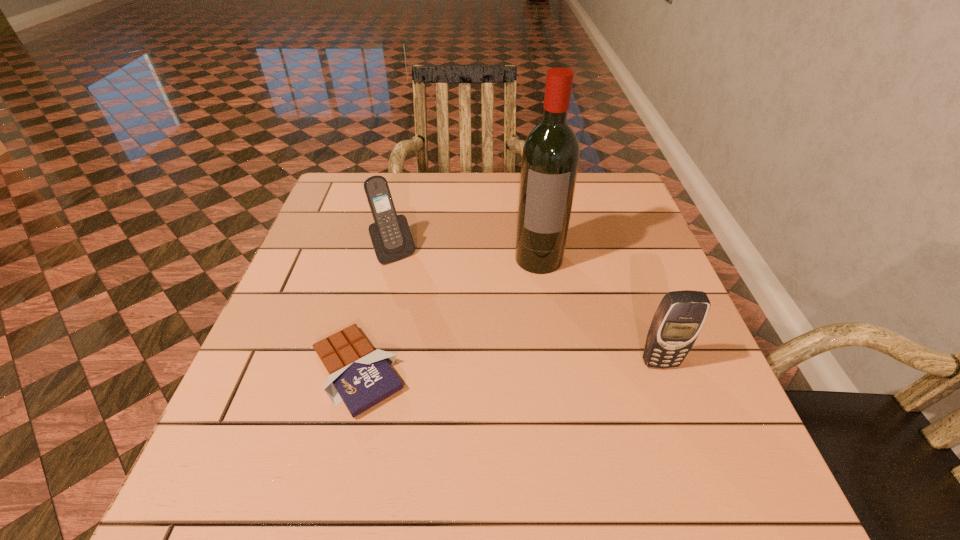
You are a GUI agent. You are given a task and a screenshot of the screen. Output one action in this format:
    pyautogui.click(x=<x>, y=<y>)
    Task: Click on the chocolate bar
    This screenshot has height=540, width=960.
    Given the screenshot: What is the action you would take?
    pyautogui.click(x=361, y=377)

At what (x,y) coordinates should I click in order to perform the action: click on the nearer cellular telephone. Please return your answer as a coordinate pair (x, y). Looking at the image, I should click on (680, 316).

Locate an element on the screen. The height and width of the screenshot is (540, 960). the right cellular telephone is located at coordinates (680, 316).

Where is `the second object from right to left`? This screenshot has width=960, height=540. the second object from right to left is located at coordinates (550, 158).

Locate an element on the screen. the tallest object is located at coordinates click(x=550, y=158).

You are a GUI agent. You are given a task and a screenshot of the screen. Output one action in this format:
    pyautogui.click(x=<x>, y=<y>)
    Task: Click on the farther cellular telephone
    The width and height of the screenshot is (960, 540).
    Given the screenshot: What is the action you would take?
    click(391, 238)

The height and width of the screenshot is (540, 960). I want to click on vacant space located on the back of the chocolate bar, so click(x=387, y=247).

Find the location of `vacant space located 0.130m on the front face of the rightmost object`. vacant space located 0.130m on the front face of the rightmost object is located at coordinates (685, 434).

The width and height of the screenshot is (960, 540). Identify the location of blank space located on the label of the wine bottle. (533, 332).

At what (x,y) coordinates should I click in order to perform the action: click on vacant area located 0.170m on the label of the wine bottle. Please return your answer as a coordinate pair (x, y). This screenshot has height=540, width=960. Looking at the image, I should click on pyautogui.click(x=534, y=329).